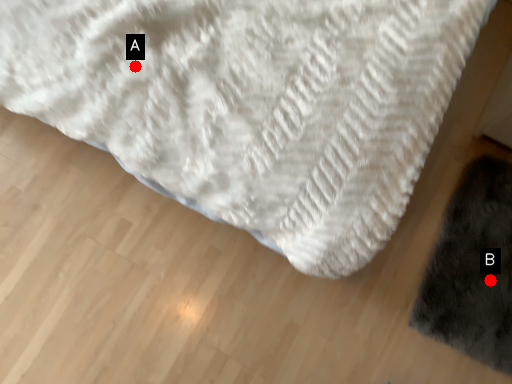
Question: Two points are circled on the image, labeled by A and B beside each circle. Which of the following is the closest to the observer?

Choices:
 (A) A is closer
 (B) B is closer

Answer: (A)